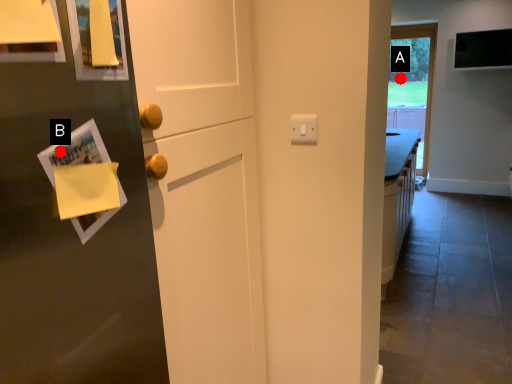
Question: Two points are circled on the image, labeled by A and B beside each circle. Which of the following is the farthest from the observer?

Choices:
 (A) A is further
 (B) B is further

Answer: (A)